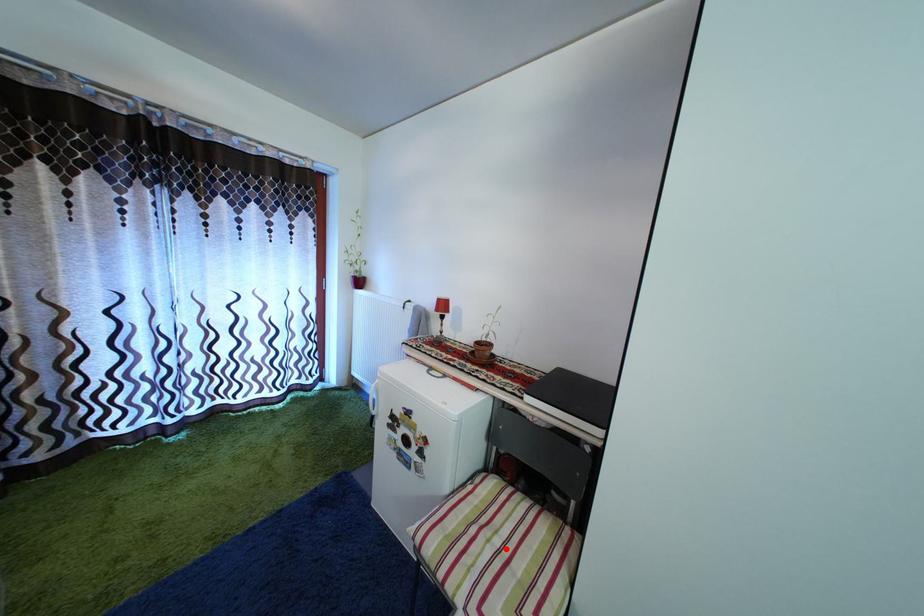
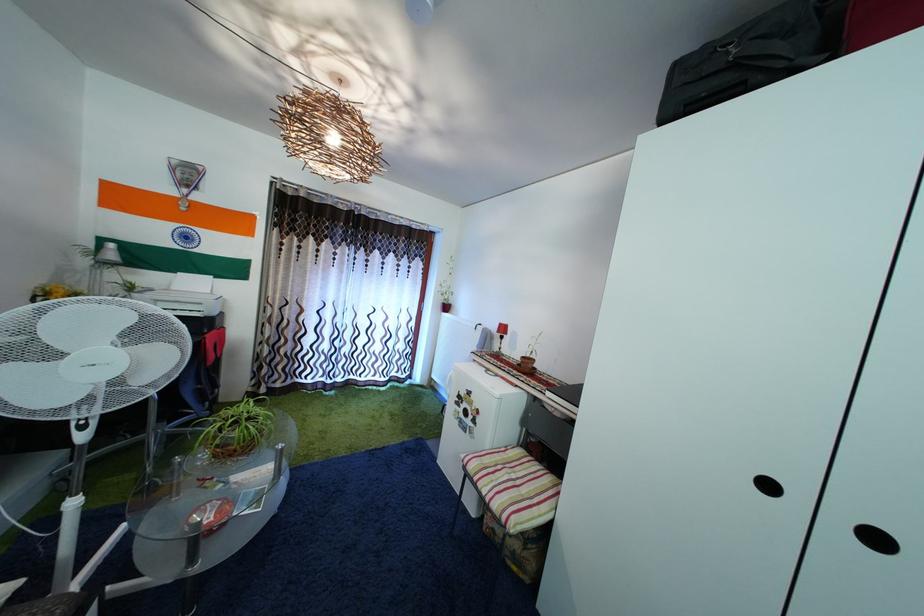
In the second image, find the point that corresponds to the highlighted location in the first image.

(521, 484)